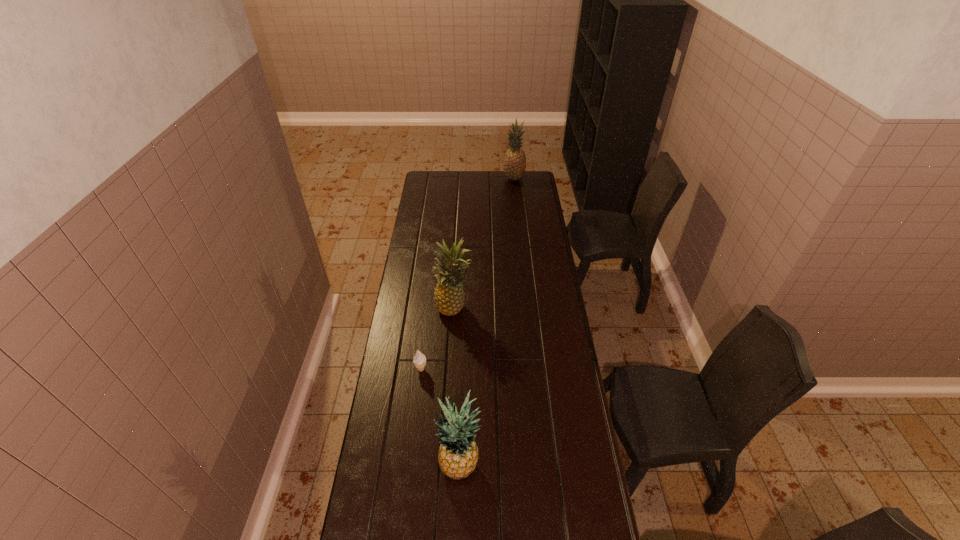
Locate an element on the screen. The image size is (960, 540). the rightmost object is located at coordinates (514, 165).

You are a GUI agent. You are given a task and a screenshot of the screen. Output one action in this format:
    pyautogui.click(x=<x>, y=<y>)
    Task: Click on the farthest object
    This screenshot has height=540, width=960.
    Given the screenshot: What is the action you would take?
    pyautogui.click(x=514, y=165)

Identify the location of the nearest pineapple. Image resolution: width=960 pixels, height=540 pixels. (458, 453).

Where is `the third nearest object`? This screenshot has height=540, width=960. the third nearest object is located at coordinates (449, 297).

The image size is (960, 540). Identify the location of icecream. (419, 360).

You are a GUI agent. You are given a task and a screenshot of the screen. Output one action in this format:
    pyautogui.click(x=<x>, y=<y>)
    Task: Click on the shortest object
    
    Given the screenshot: What is the action you would take?
    pyautogui.click(x=419, y=360)

Where is `blank space located 0.280m on the left of the farthest object`? The height and width of the screenshot is (540, 960). blank space located 0.280m on the left of the farthest object is located at coordinates (458, 179).

The width and height of the screenshot is (960, 540). I want to click on free space located 0.130m on the front of the nearest object, so click(x=458, y=534).

Identify the location of vacant space located on the front of the second nearest pineapple. Image resolution: width=960 pixels, height=540 pixels. (449, 386).

Identify the location of vacant space located on the front-facing side of the icecream. (413, 442).